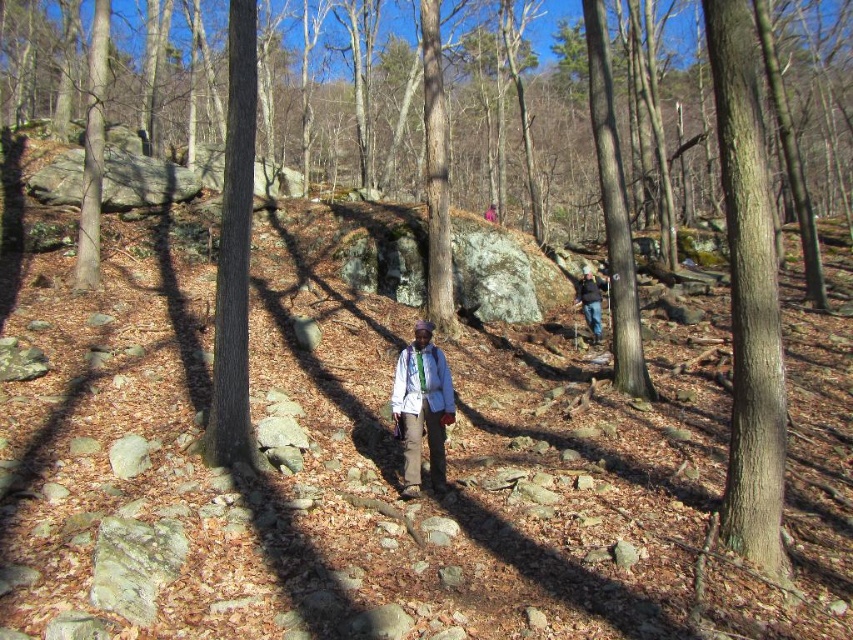
Question: Based on their relative distances, which object is farther from the smooth brown tree trunk at center?

Choices:
 (A) dark blue jacket at upper right
 (B) light blue fabric jacket at center

Answer: (A)

Question: In this image, where is brown smooth tree trunk at right located relative to dark blue jacket at upper right?

Choices:
 (A) above
 (B) below

Answer: (A)

Question: Which is nearer to the smooth brown tree trunk at center?

Choices:
 (A) dark blue jacket at upper right
 (B) brown smooth tree trunk at right
 (C) matte gray backpack at center

Answer: (B)

Question: Can you confirm if smooth brown tree trunk at center is thinner than matte gray backpack at center?

Choices:
 (A) yes
 (B) no

Answer: (B)

Question: Based on their relative distances, which object is nearer to the dark blue jacket at upper right?

Choices:
 (A) matte gray backpack at center
 (B) smooth brown tree trunk at center

Answer: (B)

Question: Is brown smooth tree trunk at right bigger than smooth brown tree trunk at center?

Choices:
 (A) yes
 (B) no

Answer: (A)